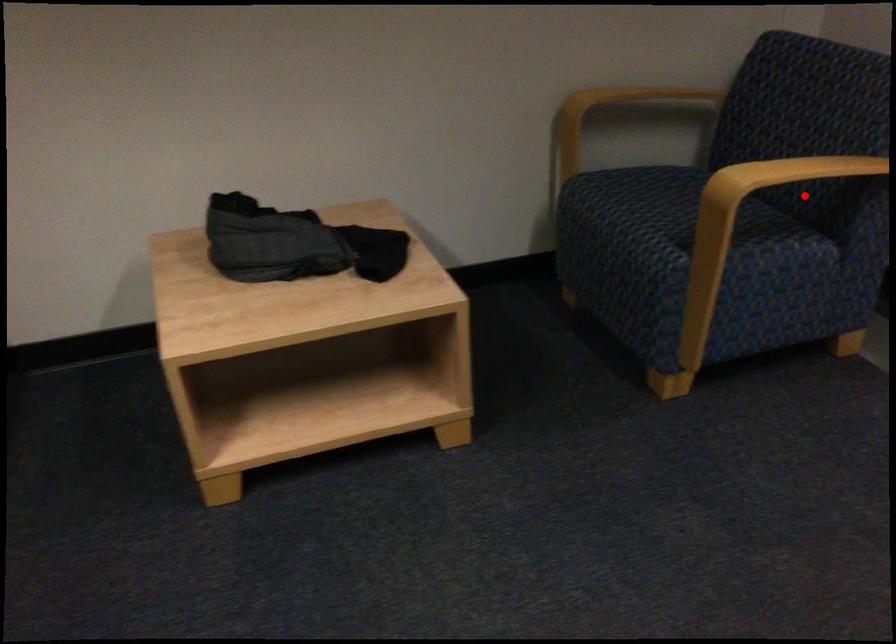
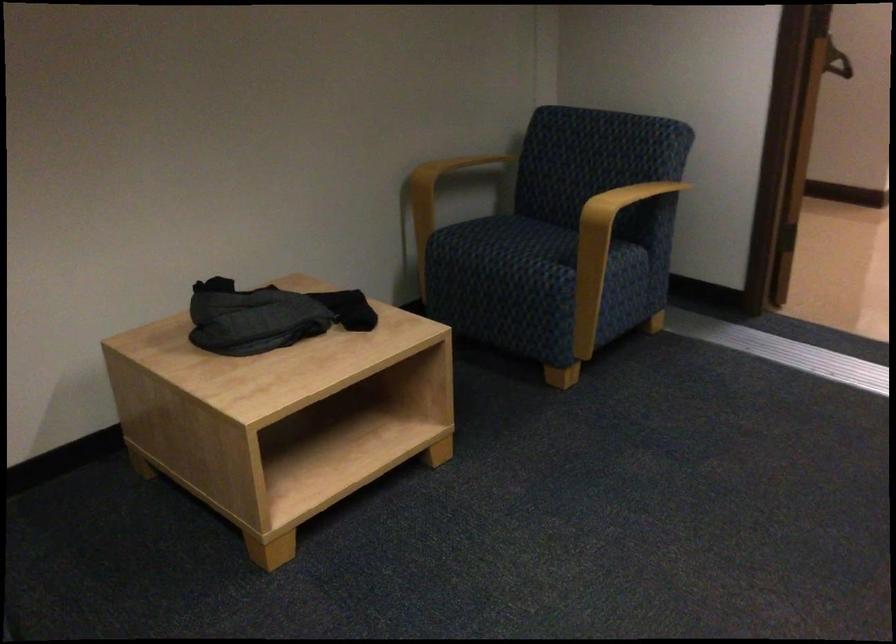
Question: I am providing you with two images of the same scene from different viewpoints. A red point is marked on the first image. At the location where the point appears in image 1, is it still visible in image 2?

Choices:
 (A) Yes
 (B) No

Answer: (A)